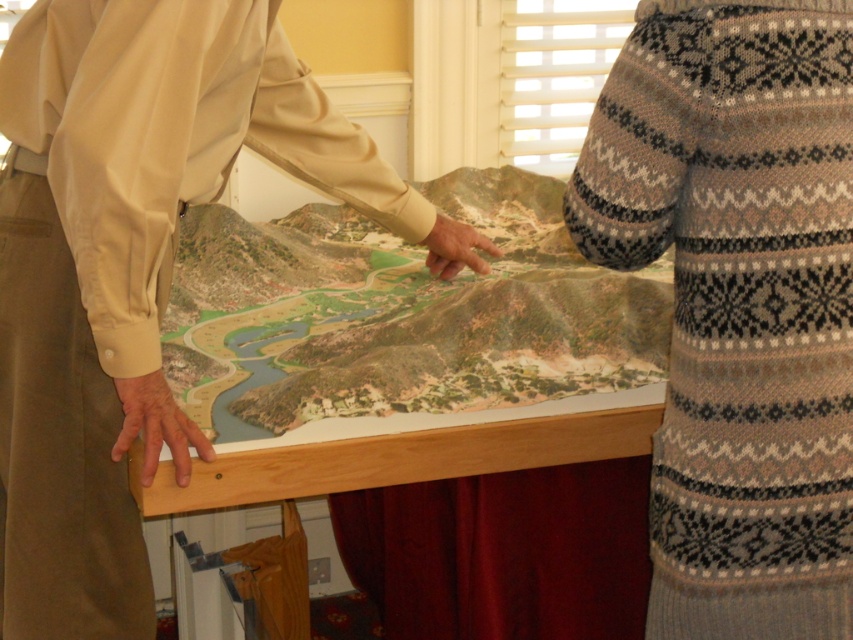
You are a photographer standing behind the two people looking at the map. You want to take a photo that clearly shows both the knitted sweater at upper right and the beige fabric shirt at upper left. Which person should you focus on first to ensure both are in focus?

You should focus on the knitted sweater at upper right first because it is closer to the viewer than the beige fabric shirt at upper left. By focusing on the closer object, both will be in focus due to the depth of field.

You are a tour guide leading a group and need to point out landmarks on the map. Which of the two people, the knitted sweater at upper right or the beige fabric shirt at upper left, is standing to the right side when facing the map?

The knitted sweater at upper right is positioned on the right side of beige fabric shirt at upper left, so the knitted sweater at upper right is standing to the right side when facing the map.

You are observing two points on the map. Which point is closer to you, point (804, 58) or point (363, 148)?

Point (804, 58) is closer to the camera than point (363, 148).